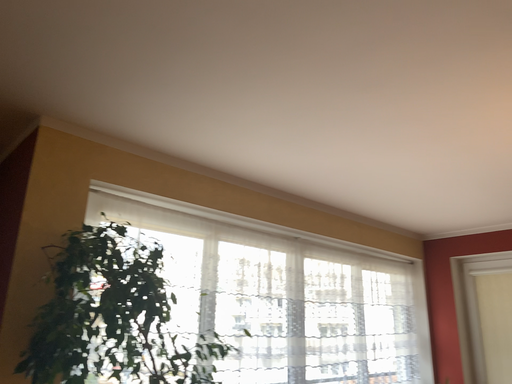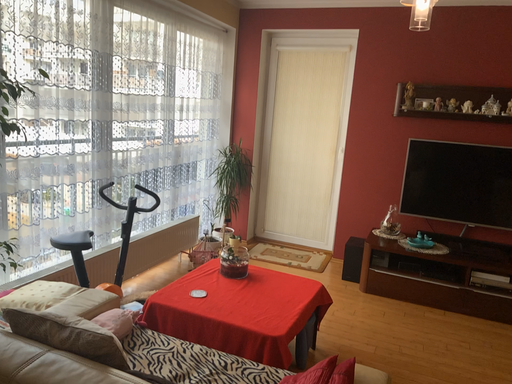
Question: How did the camera likely rotate when shooting the video?

Choices:
 (A) rotated left
 (B) rotated right

Answer: (B)